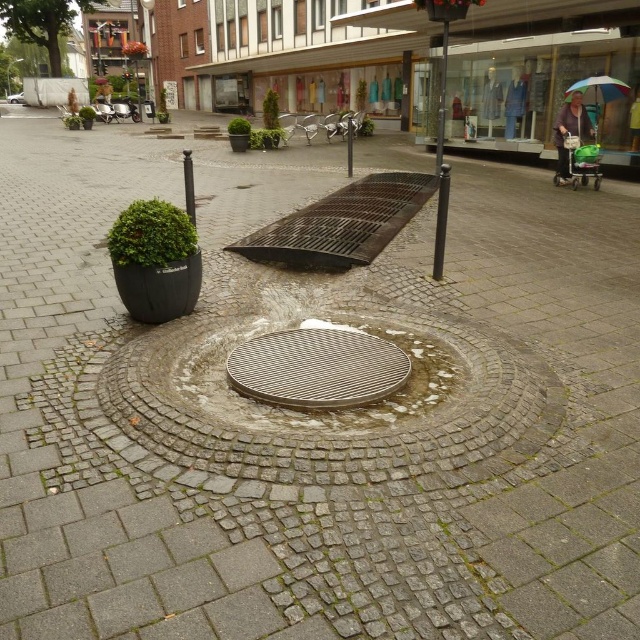
Between metallic pole at center and rainbow fabric umbrella at upper right, which one appears on the right side from the viewer's perspective?

Positioned to the right is rainbow fabric umbrella at upper right.

Can you confirm if metallic pole at center is shorter than rainbow fabric umbrella at upper right?

No.

Is point (440, 90) less distant than point (625, 88)?

No, it is behind (625, 88).

The height and width of the screenshot is (640, 640). In order to click on metallic pole at center in this screenshot , I will do `click(442, 164)`.

Between metallic grid manhole at center and black metal pole at center, which one has less height?

metallic grid manhole at center is shorter.

Can you confirm if metallic grid manhole at center is positioned above black metal pole at center?

No.

At what (x,y) coordinates should I click in order to perform the action: click on metallic grid manhole at center. Please return your answer as a coordinate pair (x, y). This screenshot has height=640, width=640. Looking at the image, I should click on (317, 369).

Measure the distance from rainbow fabric umbrella at upper right to black metal pole at center.

rainbow fabric umbrella at upper right and black metal pole at center are 9.62 meters apart from each other.

Is rainbow fabric umbrella at upper right further to the viewer compared to black metal pole at center?

Yes, rainbow fabric umbrella at upper right is behind black metal pole at center.

Is point (598, 96) closer to camera compared to point (182, 163)?

That is True.

The image size is (640, 640). Find the location of `rainbow fabric umbrella at upper right`. rainbow fabric umbrella at upper right is located at coordinates (596, 90).